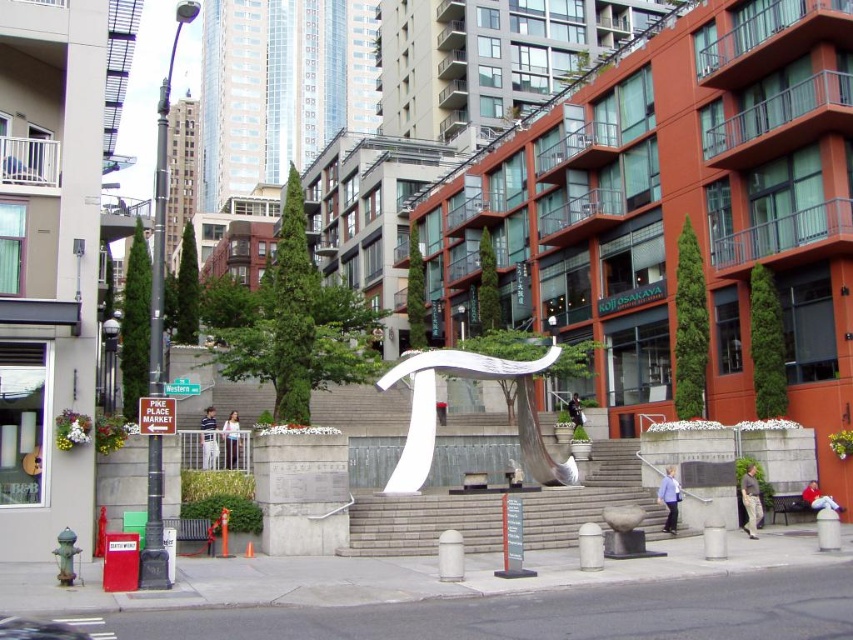
Question: Can you confirm if gray concrete stairs at center is positioned below white polished metal pi symbol at center?

Choices:
 (A) yes
 (B) no

Answer: (A)

Question: Which object is closer to the camera taking this photo?

Choices:
 (A) gray concrete stairs at center
 (B) white polished metal pi symbol at center

Answer: (A)

Question: Is gray concrete stairs at center positioned at the back of white polished metal pi symbol at center?

Choices:
 (A) yes
 (B) no

Answer: (B)

Question: Is gray concrete stairs at center above white polished metal pi symbol at center?

Choices:
 (A) yes
 (B) no

Answer: (B)